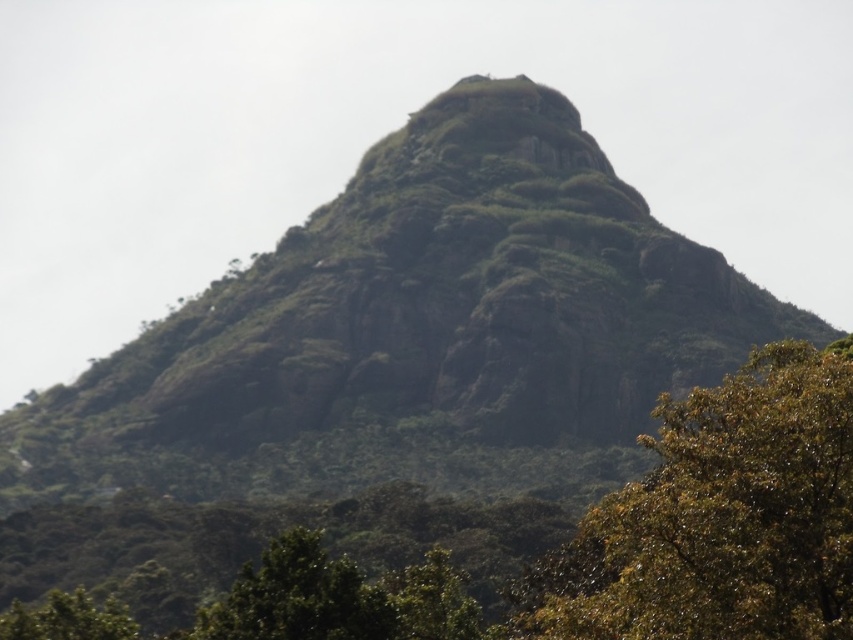
Is the position of green leafy tree at center less distant than that of green leafy tree at lower left?

Yes, it is in front of green leafy tree at lower left.

Between green leafy tree at center and green leafy tree at lower left, which one has more height?

green leafy tree at center is taller.

Does point (675, 401) come closer to viewer compared to point (85, 618)?

No, it is not.

Where is `green leafy tree at center`? green leafy tree at center is located at coordinates (718, 516).